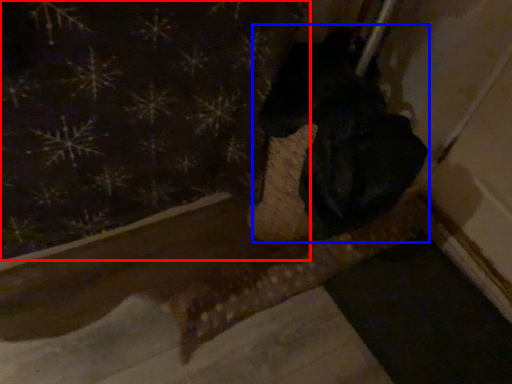
Question: Which of the following is the closest to the observer, curtain (highlighted by a red box) or animal (highlighted by a blue box)?

Choices:
 (A) curtain
 (B) animal

Answer: (A)